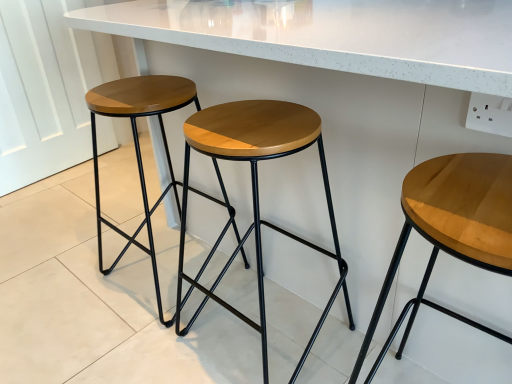
The image size is (512, 384). Find the location of `vacant region above wooden seat at center, which ranks as the 1th stool in left-to-right order (from a real-world perspective)`. vacant region above wooden seat at center, which ranks as the 1th stool in left-to-right order (from a real-world perspective) is located at coordinates (139, 92).